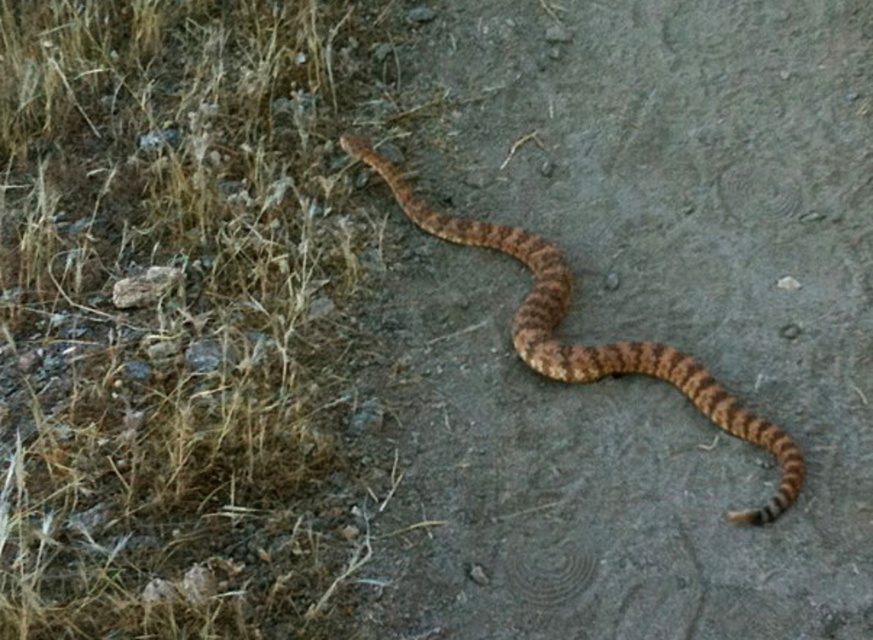
You are standing at the point marked as point (184, 317) in the image. What is the terrain like under your feet?

The point (184, 317) is on brown dry grass at upper left, so the terrain under your feet is dry grass.

You are a photographer aiming to capture the brown scaly snake at center without it being obscured by the brown dry grass at upper left. Given their heights, which object should you focus on to ensure the snake is visible?

The brown dry grass at upper left is taller than the brown scaly snake at center, so focusing on the snake will ensure it is visible above the grass.

You are an animal tracker observing a brown scaly snake at center moving along a dirt path. There is also brown dry grass at upper left in the scene. Based on the width comparison between the two, which one do you think is wider?

The brown dry grass at upper left might be wider than brown scaly snake at center according to the description.